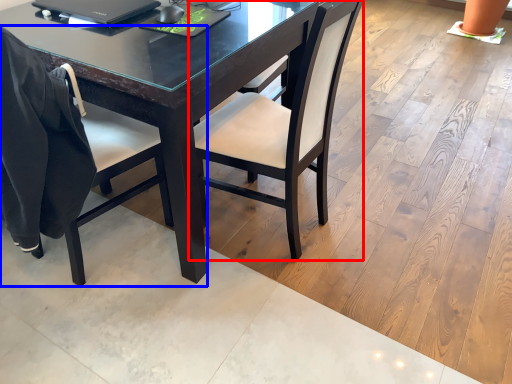
Question: Which point is closer to the camera, chair (highlighted by a red box) or chair (highlighted by a blue box)?

Choices:
 (A) chair
 (B) chair

Answer: (B)